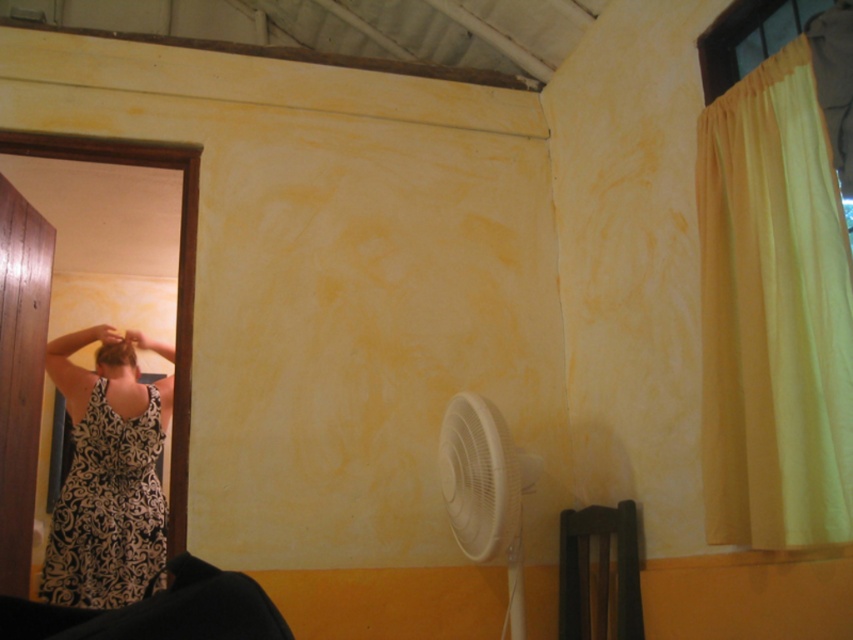
Question: Which point is closer to the camera?

Choices:
 (A) brown curly hair at upper left
 (B) yellow fabric curtain at right
 (C) white plastic fan at lower center

Answer: (B)

Question: Where is yellow fabric curtain at right located in relation to black printed fabric dress at lower left in the image?

Choices:
 (A) above
 (B) below

Answer: (A)

Question: Does black printed fabric dress at lower left appear under white plastic fan at lower center?

Choices:
 (A) yes
 (B) no

Answer: (A)

Question: Can you confirm if black printed fabric dress at lower left is smaller than white plastic fan at lower center?

Choices:
 (A) yes
 (B) no

Answer: (B)

Question: Which point is farther to the camera?

Choices:
 (A) (457, 525)
 (B) (740, 289)
 (C) (78, 536)

Answer: (C)

Question: Which point is farther to the camera?

Choices:
 (A) brown curly hair at upper left
 (B) yellow fabric curtain at right

Answer: (A)